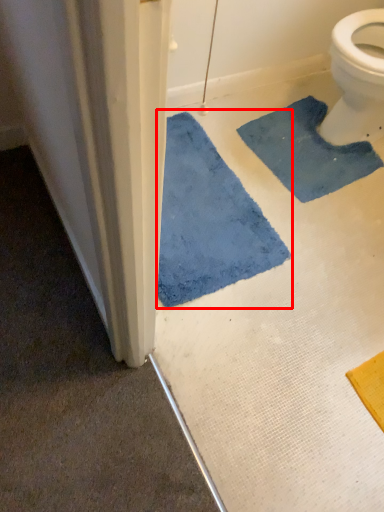
Question: Where is bath mat (annotated by the red box) located in relation to bath mat in the image?

Choices:
 (A) right
 (B) left

Answer: (B)